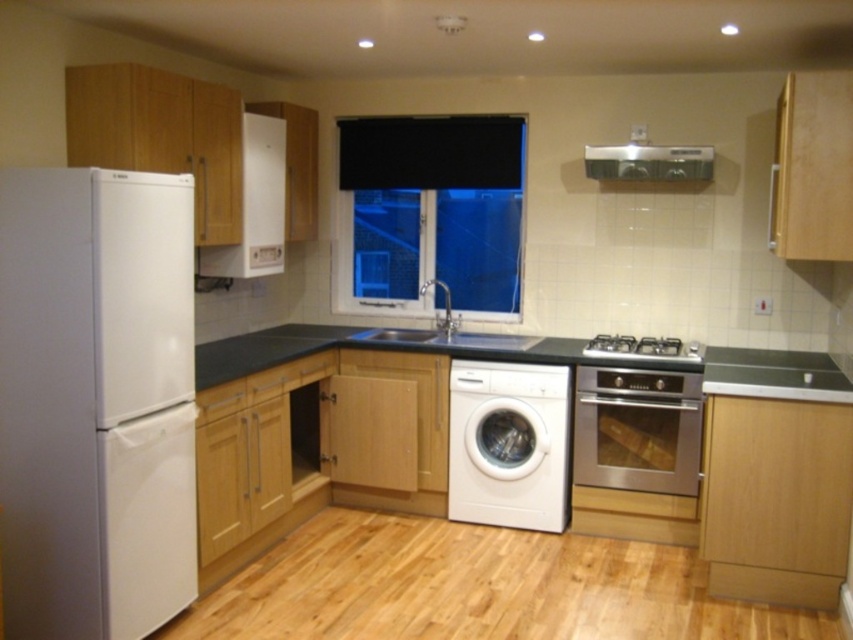
In order to click on black granite countertop at center in this screenshot , I will do `click(370, 348)`.

Is black granite countertop at center thinner than stainless steel oven at lower right?

No, black granite countertop at center is not thinner than stainless steel oven at lower right.

Locate an element on the screen. The width and height of the screenshot is (853, 640). black granite countertop at center is located at coordinates (370, 348).

You are a GUI agent. You are given a task and a screenshot of the screen. Output one action in this format:
    pyautogui.click(x=<x>, y=<y>)
    Task: Click on the black granite countertop at center
    The height and width of the screenshot is (640, 853).
    Given the screenshot: What is the action you would take?
    pyautogui.click(x=370, y=348)

Between point (175, 218) and point (402, 227), which one is positioned behind?

Positioned behind is point (402, 227).

Is white matte refrigerator at left further to camera compared to black matte window at center?

No, it is in front of black matte window at center.

Is point (32, 291) less distant than point (422, 216)?

Yes, it is.

Where is `white matte refrigerator at left`? Image resolution: width=853 pixels, height=640 pixels. white matte refrigerator at left is located at coordinates (96, 401).

Which is behind, point (585, 154) or point (444, 321)?

The point (444, 321) is more distant.

Is point (674, 173) farther from viewer compared to point (404, 340)?

No, (674, 173) is in front of (404, 340).

Does point (619, 163) come closer to viewer compared to point (434, 280)?

Yes, it is.

The width and height of the screenshot is (853, 640). What are the coordinates of `satin silver metallic exhaust hood at upper center` in the screenshot? It's located at (648, 163).